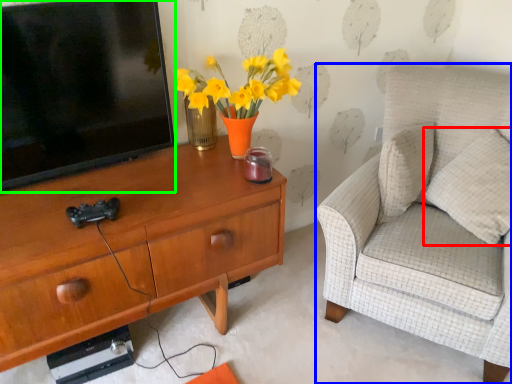
Question: Estimate the real-world distances between objects in this image. Which object is farther from pillow (highlighted by a red box), chair (highlighted by a blue box) or television (highlighted by a green box)?

Choices:
 (A) chair
 (B) television

Answer: (B)